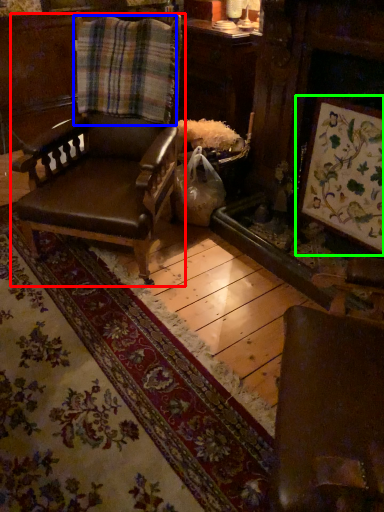
Question: Estimate the real-world distances between objects in this image. Which object is farther from chair (highlighted by a red box), plaid (highlighted by a blue box) or picture frame (highlighted by a green box)?

Choices:
 (A) plaid
 (B) picture frame

Answer: (B)